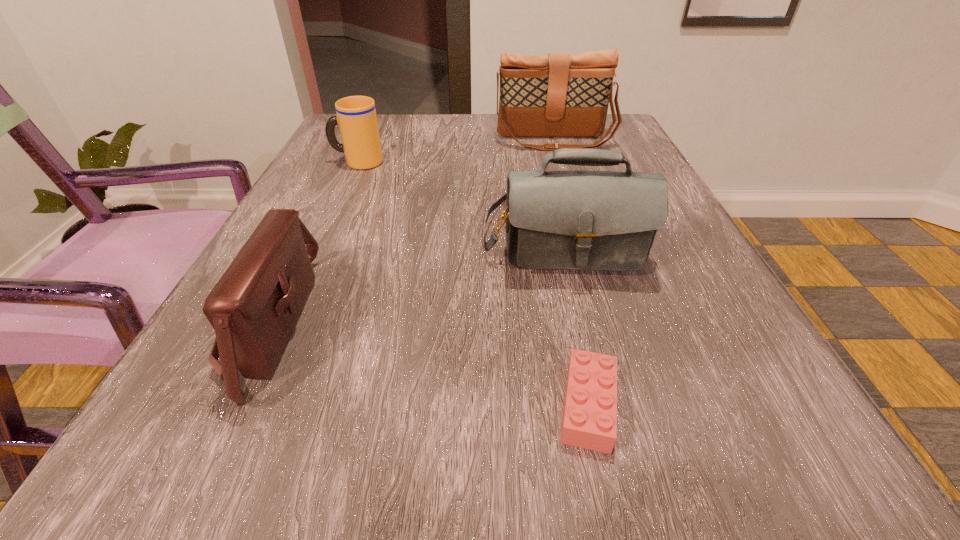
Where is `the farthest object`? This screenshot has height=540, width=960. the farthest object is located at coordinates (557, 95).

Identify the location of the leftmost shoulder bag. This screenshot has width=960, height=540. (253, 308).

The height and width of the screenshot is (540, 960). In order to click on cup in this screenshot , I will do `click(356, 116)`.

This screenshot has height=540, width=960. In order to click on the shortest object in this screenshot , I will do tap(589, 421).

This screenshot has height=540, width=960. In order to click on vacant space situated on the front-facing side of the farthest object in this screenshot , I will do (562, 164).

You are a GUI agent. You are given a task and a screenshot of the screen. Output one action in this format:
    pyautogui.click(x=<x>, y=<y>)
    Task: Click on the vacant space positioned 0.210m on the front flap of the shortest shoulder bag
    The width and height of the screenshot is (960, 540).
    Given the screenshot: What is the action you would take?
    pyautogui.click(x=455, y=325)

The height and width of the screenshot is (540, 960). I want to click on vacant space located on the back of the shortest object, so point(560,274).

I want to click on object positioned at the far edge, so click(x=557, y=95).

Identify the location of object present at the near edge. (589, 421).

The height and width of the screenshot is (540, 960). In order to click on shoulder bag located at the left edge in this screenshot , I will do `click(253, 308)`.